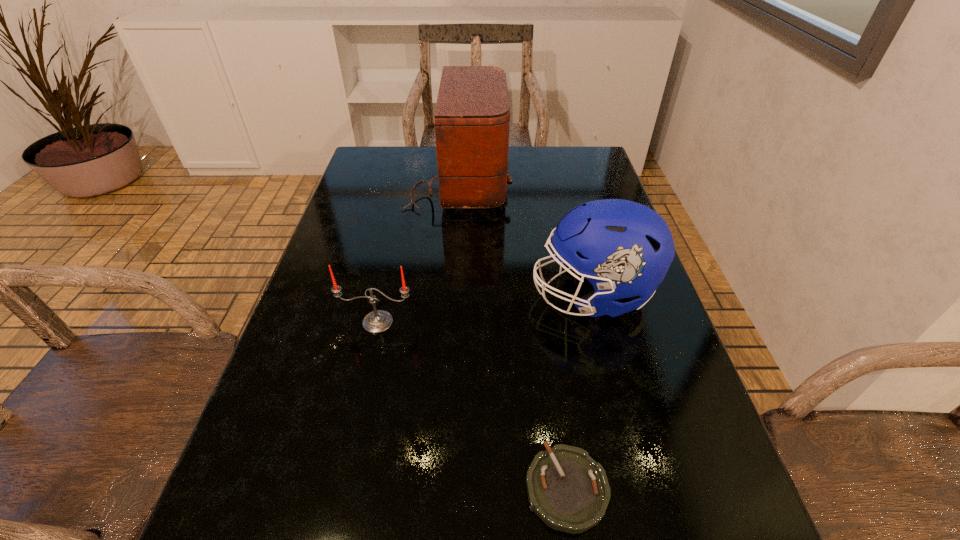
Find the location of a particular element. the farthest object is located at coordinates (472, 116).

Where is `radio receiver`? radio receiver is located at coordinates (472, 116).

The image size is (960, 540). I want to click on football helmet, so click(624, 249).

At what (x,y) coordinates should I click in order to perform the action: click on candle. Please return your answer as a coordinate pair (x, y). The width and height of the screenshot is (960, 540). Looking at the image, I should click on (378, 321).

In order to click on ashtray in this screenshot , I will do `click(569, 491)`.

The height and width of the screenshot is (540, 960). I want to click on the shortest object, so click(x=569, y=491).

Locate an element on the screen. The width and height of the screenshot is (960, 540). vacant region located 0.240m on the front panel of the radio receiver is located at coordinates point(590,181).

You are a GUI agent. You are given a task and a screenshot of the screen. Output one action in this format:
    pyautogui.click(x=<x>, y=<y>)
    Task: Click on the vacant space situated 0.050m on the face guard of the third shortest object
    The width and height of the screenshot is (960, 540).
    Given the screenshot: What is the action you would take?
    pyautogui.click(x=508, y=295)

You are a GUI agent. You are given a task and a screenshot of the screen. Output one action in this format:
    pyautogui.click(x=<x>, y=<y>)
    Task: Click on the free point located 0.050m on the face guard of the third shortest object
    The width and height of the screenshot is (960, 540).
    Given the screenshot: What is the action you would take?
    pyautogui.click(x=508, y=295)

Where is `free space located on the face guard of the third shortest object`? This screenshot has height=540, width=960. free space located on the face guard of the third shortest object is located at coordinates (411, 295).